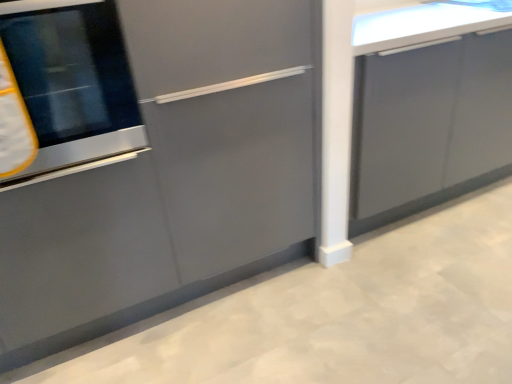
Question: Is matte gray cabinet at left, which is the first cabinetry in left-to-right order, positioned in front of stainless steel oven at left?

Choices:
 (A) yes
 (B) no

Answer: (A)

Question: Considering the relative sizes of matte gray cabinet at left, which is the first cabinetry in left-to-right order, and stainless steel oven at left in the image provided, is matte gray cabinet at left, which is the first cabinetry in left-to-right order, wider than stainless steel oven at left?

Choices:
 (A) no
 (B) yes

Answer: (A)

Question: From a real-world perspective, does matte gray cabinet at left, which is the first cabinetry in left-to-right order, sit lower than stainless steel oven at left?

Choices:
 (A) no
 (B) yes

Answer: (B)

Question: Could you tell me if matte gray cabinet at left, which is the first cabinetry in left-to-right order, is facing stainless steel oven at left?

Choices:
 (A) yes
 (B) no

Answer: (A)

Question: Is matte gray cabinet at left, which is the first cabinetry in left-to-right order, looking in the opposite direction of stainless steel oven at left?

Choices:
 (A) yes
 (B) no

Answer: (A)

Question: From a real-world perspective, is stainless steel oven at left positioned above or below matte gray cabinet at left, acting as the 2th cabinetry starting from the right?

Choices:
 (A) below
 (B) above

Answer: (B)

Question: Is stainless steel oven at left situated inside matte gray cabinet at left, acting as the 2th cabinetry starting from the right, or outside?

Choices:
 (A) outside
 (B) inside

Answer: (B)

Question: Is point (82, 147) closer or farther from the camera than point (205, 109)?

Choices:
 (A) farther
 (B) closer

Answer: (B)

Question: Looking at their shapes, would you say stainless steel oven at left is wider or thinner than matte gray cabinet at left, acting as the 2th cabinetry starting from the right?

Choices:
 (A) wide
 (B) thin

Answer: (A)

Question: From a real-world perspective, is stainless steel oven at left positioned above or below glossy gray cabinet at right, placed as the 1th cabinetry when sorted from right to left?

Choices:
 (A) below
 (B) above

Answer: (B)

Question: Is stainless steel oven at left to the left or to the right of glossy gray cabinet at right, positioned as the second cabinetry in left-to-right order, in the image?

Choices:
 (A) left
 (B) right

Answer: (A)

Question: In terms of size, does stainless steel oven at left appear bigger or smaller than glossy gray cabinet at right, positioned as the second cabinetry in left-to-right order?

Choices:
 (A) small
 (B) big

Answer: (A)

Question: Is stainless steel oven at left inside the boundaries of glossy gray cabinet at right, placed as the 1th cabinetry when sorted from right to left, or outside?

Choices:
 (A) outside
 (B) inside

Answer: (A)

Question: Is glossy gray cabinet at right, positioned as the second cabinetry in left-to-right order, inside the boundaries of matte gray cabinet at left, acting as the 2th cabinetry starting from the right, or outside?

Choices:
 (A) inside
 (B) outside

Answer: (B)

Question: In the image, is glossy gray cabinet at right, placed as the 1th cabinetry when sorted from right to left, positioned in front of or behind matte gray cabinet at left, acting as the 2th cabinetry starting from the right?

Choices:
 (A) behind
 (B) front

Answer: (A)